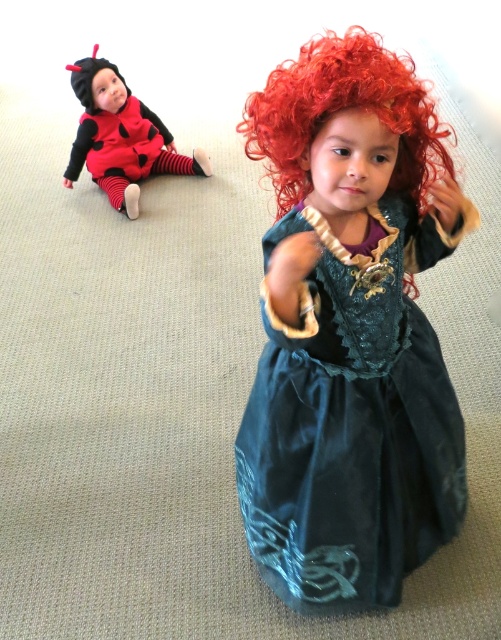
You are a photographer setting up for a photo shoot with two children in costumes. You need to position them so that the teal velvet dress at center and the matte black and red costume at upper left are both visible in the frame. Based on their current positions, which costume is lower in the image?

The teal velvet dress at center is below the matte black and red costume at upper left, so the teal velvet dress at center is lower in the image.

You are a photographer setting up for a group photo. You need to ensure that all costumes are visible in the frame. Given that the curly red wig at center and the matte black and red costume at upper left are part of the setup, which costume requires more space to accommodate in the photo?

The matte black and red costume at upper left requires more space because it occupies more area than the curly red wig at center.

You are a photographer setting up for a group photo of the two children in their costumes. You need to position a small prop between them so that it appears closer to the child in the dark green dress with red wig. Which point should you place the prop at, point A at coordinates point A is point (280, 234) or point B at coordinates point B is point (75, 90)?

The prop should be placed at point A at coordinates point A is point (280, 234) because it is closer to the viewer than point B at coordinates point B is point (75, 90). This placement will make the prop appear nearer to the child in the dark green dress with red wig.